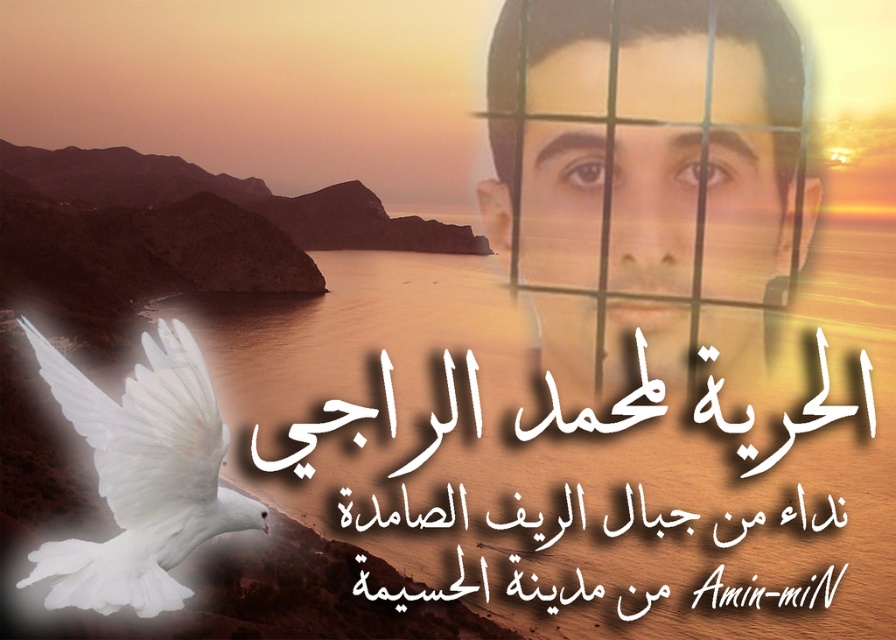
Question: In this image, where is smooth skin face at upper right located relative to white feathered dove at lower left?

Choices:
 (A) below
 (B) above

Answer: (B)

Question: Can you confirm if smooth skin face at upper right is bigger than white feathered dove at lower left?

Choices:
 (A) yes
 (B) no

Answer: (A)

Question: Among these objects, which one is farthest from the camera?

Choices:
 (A) white feathered dove at lower left
 (B) smooth skin face at upper right

Answer: (B)

Question: Is smooth skin face at upper right to the left of white feathered dove at lower left from the viewer's perspective?

Choices:
 (A) no
 (B) yes

Answer: (A)

Question: Which of the following is the farthest from the observer?

Choices:
 (A) (770, 172)
 (B) (253, 515)

Answer: (A)

Question: Which of the following is the closest to the observer?

Choices:
 (A) smooth skin face at upper right
 (B) white feathered dove at lower left

Answer: (B)